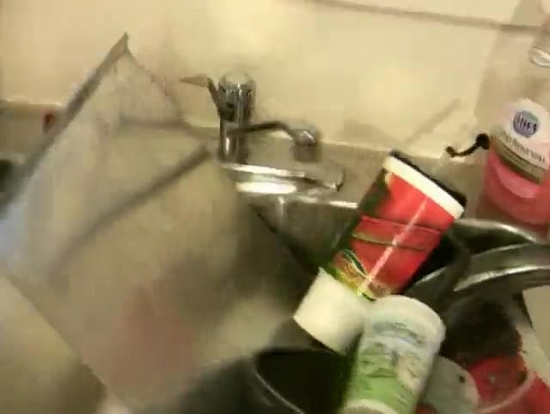
At what (x,y) coordinates should I click in order to perform the action: click on metal sink rim. Please return your answer as a coordinate pair (x, y). Image resolution: width=550 pixels, height=414 pixels. Looking at the image, I should click on (306, 214).